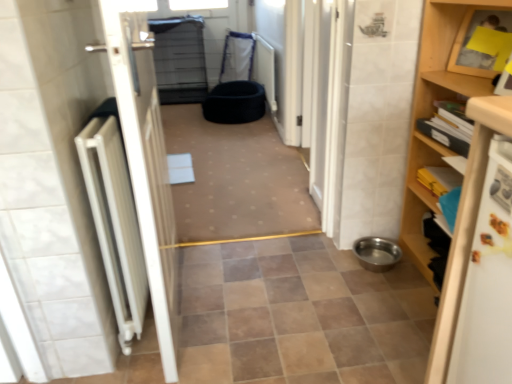
Find the location of `empty space that is to the right of white matte door at left`. empty space that is to the right of white matte door at left is located at coordinates [278, 307].